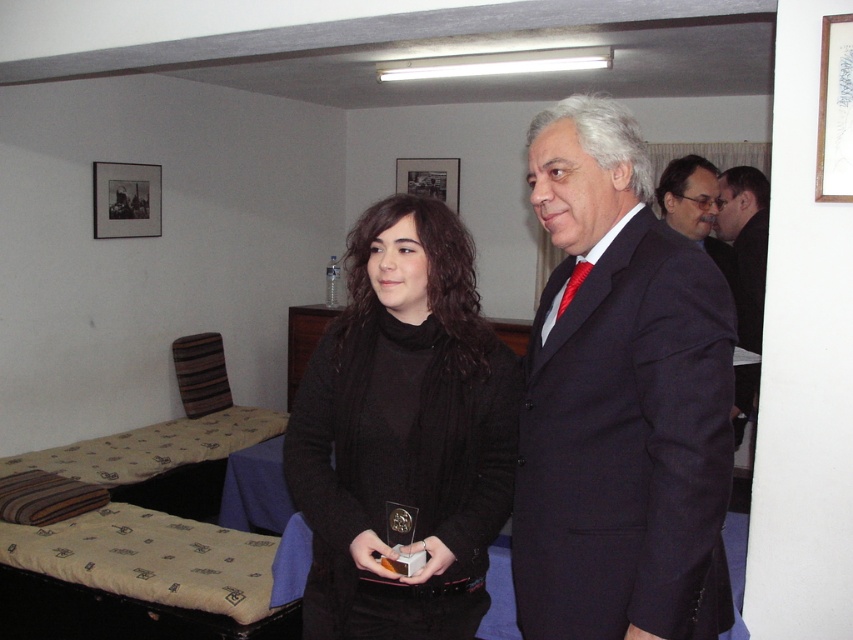
What object is located at the coordinates point (619, 401) in the image?

The point (619, 401) corresponds to the matte black coat at center.

You are an interior designer assessing the placement of items in the room. The black knitted sweater at center and the black matte picture frame at upper center are both in your view. Which object is positioned higher up in the image?

The black matte picture frame at upper center is positioned higher up in the image compared to the black knitted sweater at center.

You are a photographer setting up for a photo shoot in the described room. You need to position two subjects wearing the matte black coat at center and dark blue suit at center so that there is enough space between them for a camera to fit. The camera requires at least 0.5 inches of space to operate. Can the current spacing between the two subjects accommodate this requirement?

The matte black coat at center and dark blue suit at center are currently 0.35 inches apart. Since the camera requires at least 0.5 inches of space, the current spacing is insufficient. The subjects need to move further apart to meet the requirement.